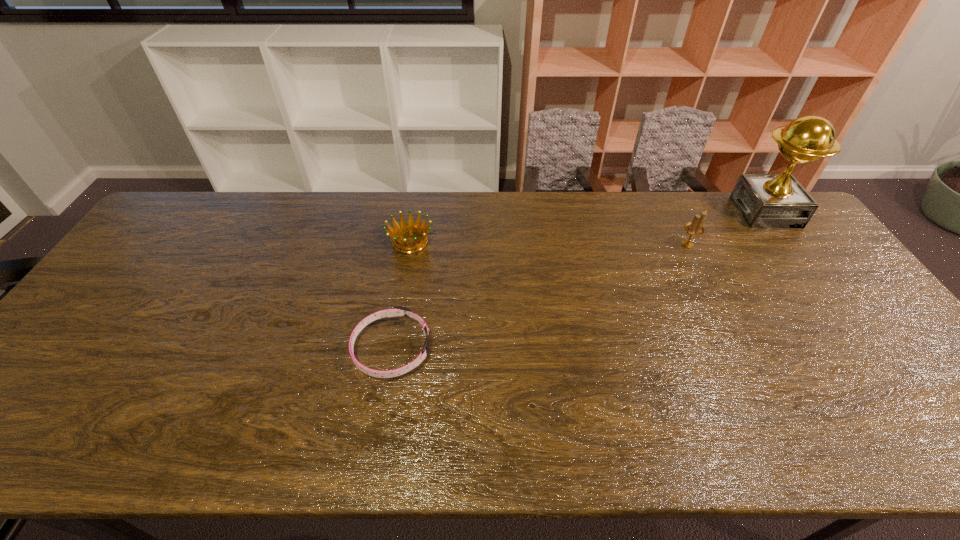
You are a GUI agent. You are given a task and a screenshot of the screen. Output one action in this format:
    pyautogui.click(x=<x>, y=<y>)
    Task: Click on the vacant space located 0.150m on the left of the second object from right to left
    This screenshot has width=960, height=540.
    Given the screenshot: What is the action you would take?
    pyautogui.click(x=630, y=245)

This screenshot has height=540, width=960. Identify the location of vacant space located 0.130m on the front of the crown. (402, 289).

The image size is (960, 540). Identify the location of free space located 0.390m with the buckle on the shortest object. (585, 349).

You are a GUI agent. You are given a task and a screenshot of the screen. Output one action in this format:
    pyautogui.click(x=<x>, y=<y>)
    Task: Click on the award that is positioned at the far edge
    The image size is (960, 540).
    Given the screenshot: What is the action you would take?
    pyautogui.click(x=765, y=200)

Identify the location of crown present at the far edge. This screenshot has width=960, height=540. (404, 227).

You are a GUI agent. You are given a task and a screenshot of the screen. Output one action in this format:
    pyautogui.click(x=<x>, y=<y>)
    Task: Click on the object at the right edge
    
    Given the screenshot: What is the action you would take?
    [x=765, y=200]

You are a GUI agent. You are given a task and a screenshot of the screen. Output one action in this format:
    pyautogui.click(x=<x>, y=<y>)
    Task: Click on the object situated at the far right corner
    This screenshot has width=960, height=540.
    Given the screenshot: What is the action you would take?
    pyautogui.click(x=765, y=200)

At what (x,y) coordinates should I click in order to perform the action: click on vacant space at the far edge of the desktop. Please return your answer as a coordinate pair (x, y). This screenshot has height=540, width=960. Looking at the image, I should click on (429, 210).

Locate an element on the screen. The height and width of the screenshot is (540, 960). vacant space at the near edge of the desktop is located at coordinates (175, 449).

This screenshot has height=540, width=960. Identify the location of vacant region at the left edge of the desktop. (48, 359).